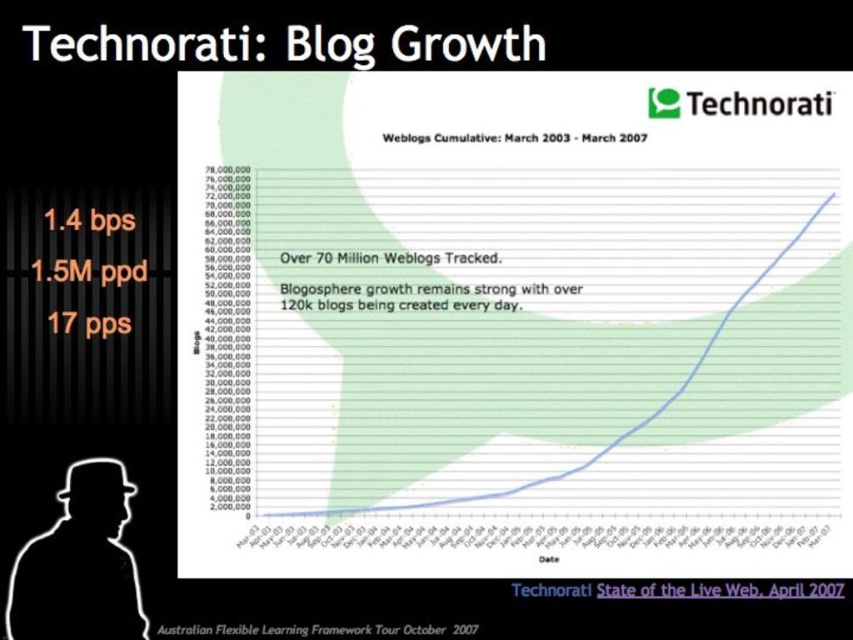
Question: Which point is farther to the camera?

Choices:
 (A) white gridlines at bottom
 (B) black paper at lower center

Answer: (B)

Question: Is black paper at lower center thinner than green logo at upper center?

Choices:
 (A) no
 (B) yes

Answer: (A)

Question: Does black text at upper center have a smaller size compared to green logo at upper center?

Choices:
 (A) no
 (B) yes

Answer: (A)

Question: Does white matte silhouette at lower left come behind orange text at left?

Choices:
 (A) no
 (B) yes

Answer: (A)

Question: Which point is closer to the camera?

Choices:
 (A) white paper at center
 (B) black paper at lower center
 (C) green logo at upper center
 (D) black text at upper center

Answer: (D)

Question: Which object is positioned closest to the black text at upper center?

Choices:
 (A) white text at upper center
 (B) white paper at center
 (C) white gridlines at bottom

Answer: (A)